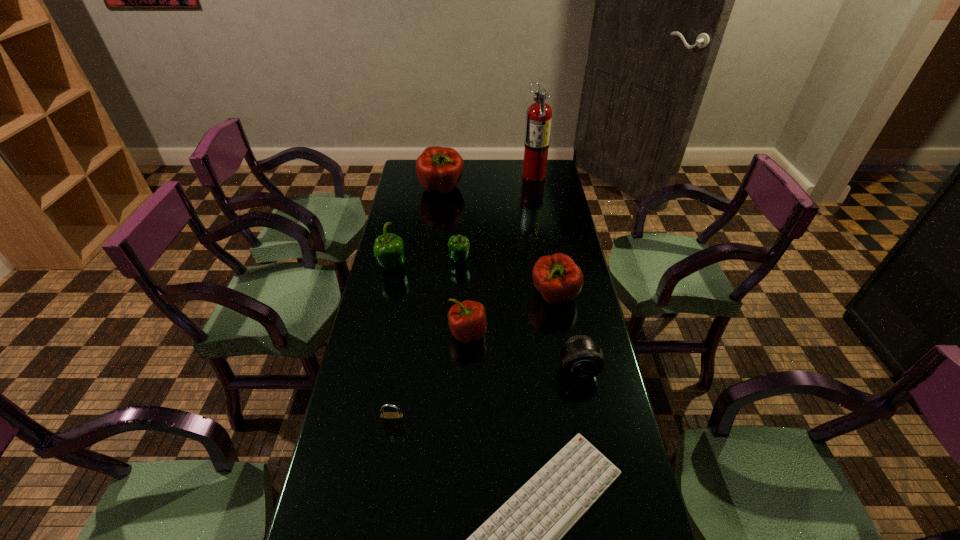
At what (x,y) coordinates should I click in order to perform the action: click on object that is at the far right corner. Please return your answer as a coordinate pair (x, y). Looking at the image, I should click on (539, 114).

In the image, there is a desktop. At what (x,y) coordinates should I click in order to perform the action: click on vacant region at the far edge. Please return your answer as a coordinate pair (x, y). Looking at the image, I should click on (498, 169).

Locate an element on the screen. free region at the left edge of the desktop is located at coordinates (359, 517).

In the image, there is a desktop. At what (x,y) coordinates should I click in order to perform the action: click on blank space at the right edge. Please return your answer as a coordinate pair (x, y). Image resolution: width=960 pixels, height=540 pixels. Looking at the image, I should click on (577, 303).

You are a GUI agent. You are given a task and a screenshot of the screen. Output one action in this format:
    pyautogui.click(x=<x>, y=<y>)
    Task: Click on the free spot between the smaller green bell pepper and the eighth tallest object
    
    Given the screenshot: What is the action you would take?
    pyautogui.click(x=426, y=342)

Identify the location of vacant space that's between the telephoto lens and the farthest pink bell pepper. The height and width of the screenshot is (540, 960). (510, 279).

Find the location of a particular element. vacant point located between the padlock and the smallest pink bell pepper is located at coordinates (431, 379).

The image size is (960, 540). What are the coordinates of `vacant area between the farthest pink bell pepper and the smaller green bell pepper` in the screenshot? It's located at (450, 225).

This screenshot has width=960, height=540. What are the coordinates of `vacant region between the third nearest object and the right green bell pepper` in the screenshot? It's located at (519, 315).

This screenshot has width=960, height=540. Identify the location of empty space between the farthest bell pepper and the second nearest bell pepper. (498, 242).